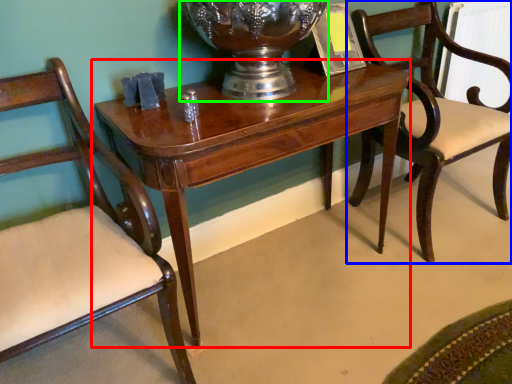
Question: Which object is the farthest from table (highlighted by a red box)? Choose among these: chair (highlighted by a blue box) or glass vase (highlighted by a green box).

Choices:
 (A) chair
 (B) glass vase

Answer: (A)